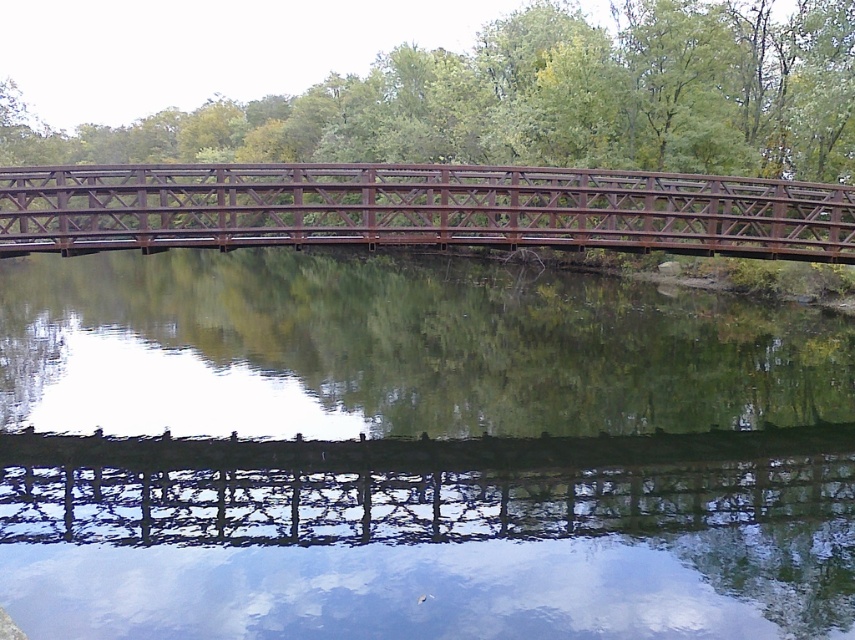
You are standing on the metal bridge and want to locate the green reflective water at center. According to the coordinates provided, where exactly should you look?

The green reflective water at center is located at coordinates point (x=416, y=452).